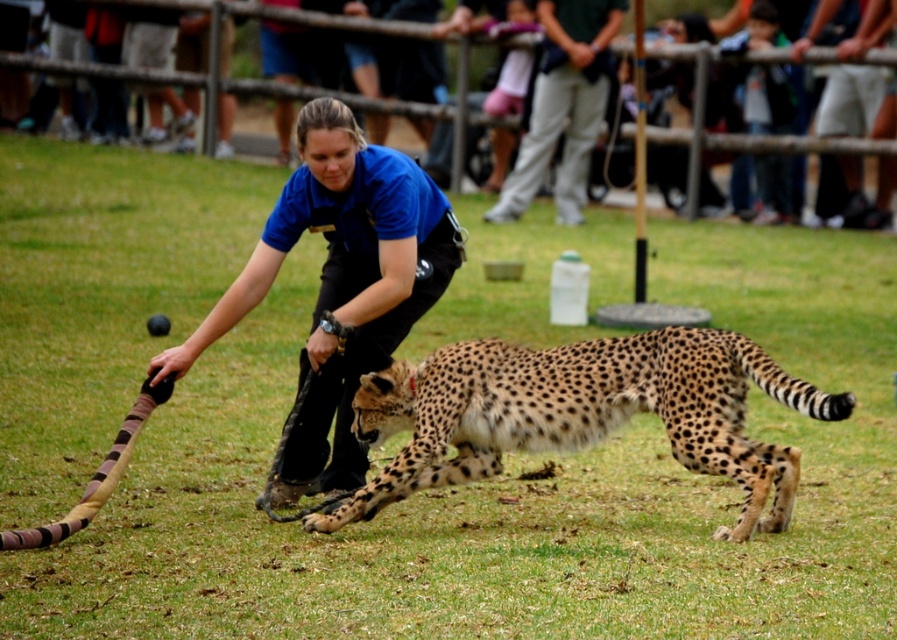
You are a wildlife photographer trying to capture a photo of the spotted fur cheetah at center and the blue uniform at center. Which object is wider in the image?

The spotted fur cheetah at center might be wider than blue uniform at center according to the description.

You are a photographer observing the scene. You need to capture a photo where both the blue uniform at center and the light pink fabric at upper center are visible. Based on their positions, which object is closer to the bottom of the image?

The blue uniform at center is closer to the bottom of the image because it is positioned below the light pink fabric at upper center.